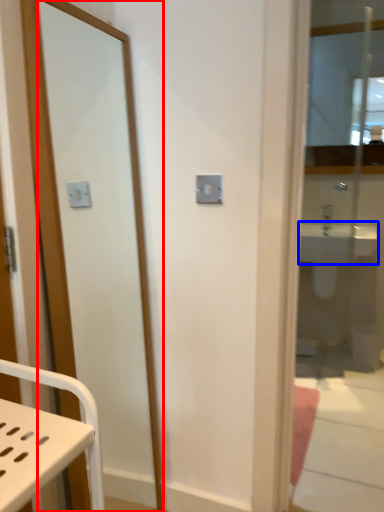
Question: Which object appears closest to the camera in this image, mirror (highlighted by a red box) or sink (highlighted by a blue box)?

Choices:
 (A) mirror
 (B) sink

Answer: (A)